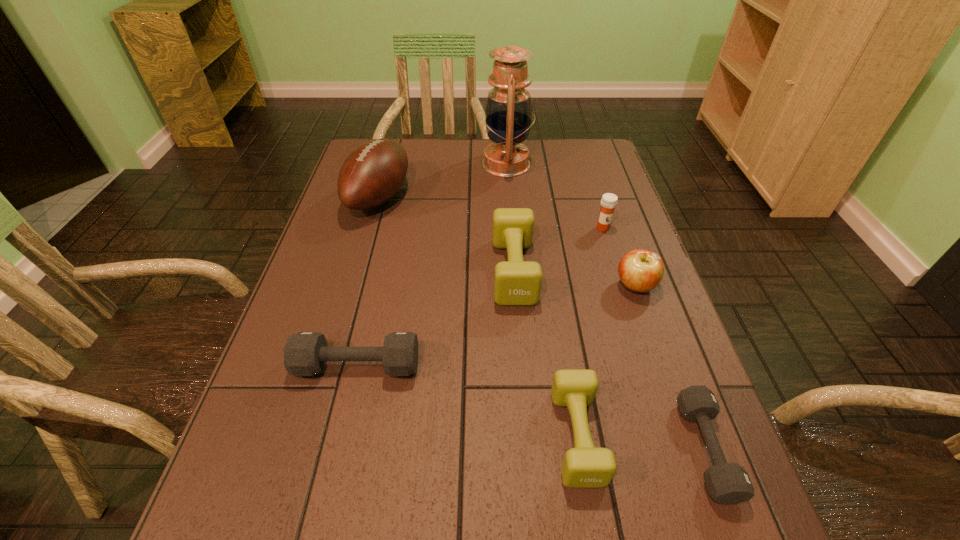
Where is `the nearer olive dumbbell`? The width and height of the screenshot is (960, 540). the nearer olive dumbbell is located at coordinates (585, 466).

Where is `the third dumbbell from left to right`? the third dumbbell from left to right is located at coordinates (585, 466).

Locate an element on the screen. the nearer gray dumbbell is located at coordinates (728, 483).

Find the location of a particular element. the rightmost dumbbell is located at coordinates (728, 483).

At what (x,y) coordinates should I click in order to perform the action: click on vacant space located on the right of the blue oil lamp. Please return your answer as a coordinate pair (x, y). The image size is (960, 540). Looking at the image, I should click on (596, 164).

Identify the location of vacant area located on the right of the football (American). Image resolution: width=960 pixels, height=540 pixels. (481, 198).

Locate an element on the screen. free region located 0.120m on the back of the farthest dumbbell is located at coordinates (510, 211).

This screenshot has width=960, height=540. I want to click on vacant space located 0.360m on the label side of the medicine, so click(638, 342).

At what (x,y) coordinates should I click in order to perform the action: click on free space located on the front of the apple. Please return your answer as a coordinate pair (x, y). Looking at the image, I should click on (652, 333).

At what (x,y) coordinates should I click in order to perform the action: click on blank space located on the right of the bigger gray dumbbell. Please return your answer as a coordinate pair (x, y). This screenshot has width=960, height=540. Looking at the image, I should click on (538, 366).